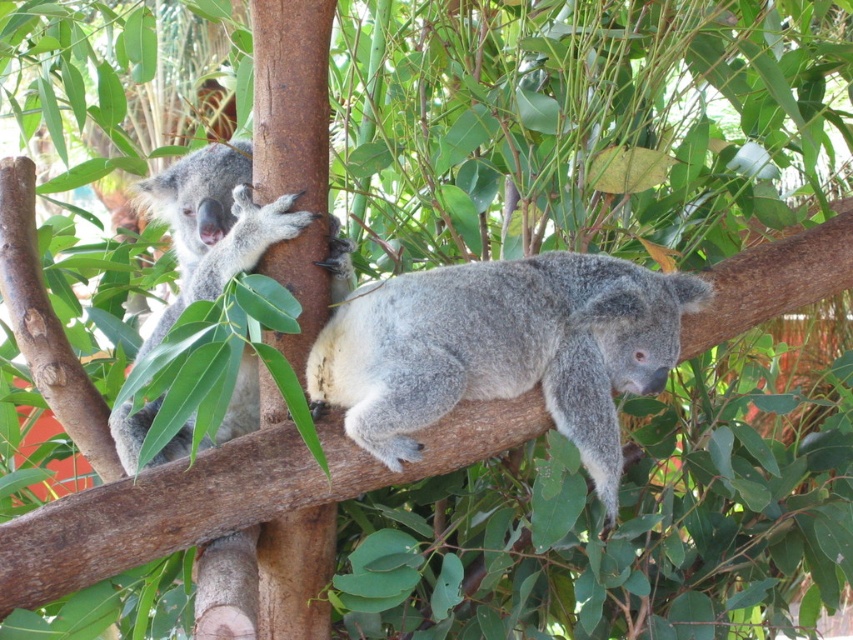
You are a wildlife photographer aiming to capture a clear photo of both gray furry koala at center and gray furry koala at left. Based on their positions, which koala might partially block the view of the other?

The gray furry koala at center is in front of the gray furry koala at left, so it might partially block the view of the gray furry koala at left when taking the photo.

You are a wildlife photographer aiming to capture a closeup of the gray furry koala at left and the gray furry koala at center. Since the camera can only focus on one subject at a time, which koala should you adjust your focus to if you want to take a photo of the one closer to the left side of the image?

You should focus on the gray furry koala at left because it is positioned on the left side of the image, while the gray furry koala at center is to the right of it.

You are a wildlife photographer aiming to capture a closeup shot of the koala at point [566,301] and the other at point [212,160]. Since you want to focus on the one closer to the camera, which point should you prioritize?

Result: Point [566,301] is in front of point [212,160], so you should prioritize focusing on the koala at point [566,301] since it is closer to the camera.